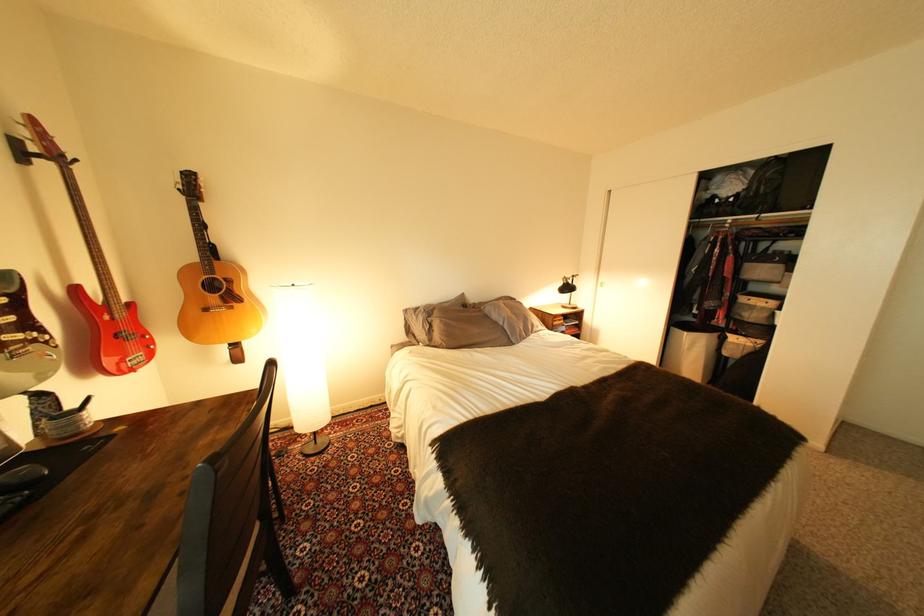
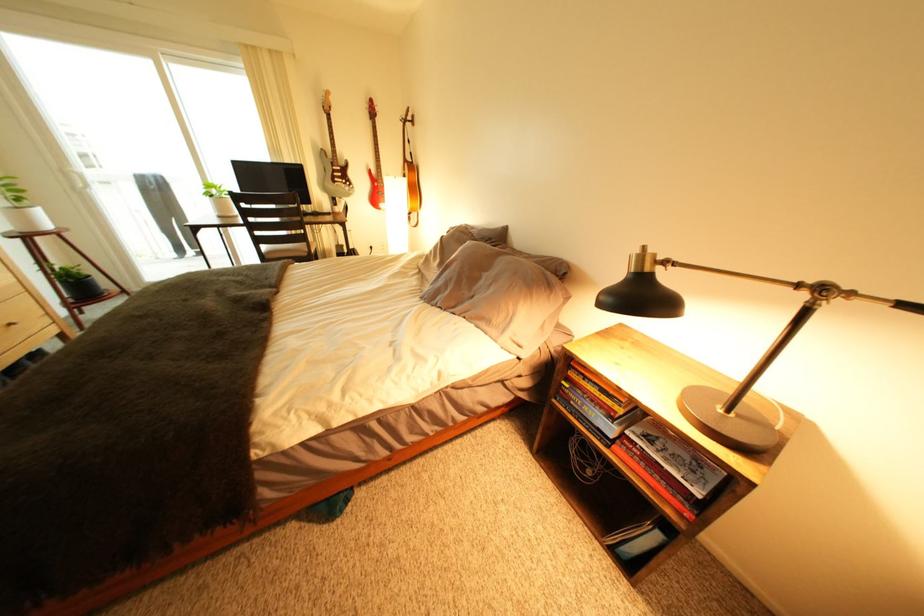
Find the pixel in the second image that matches point 26,350 in the first image.

(349, 185)